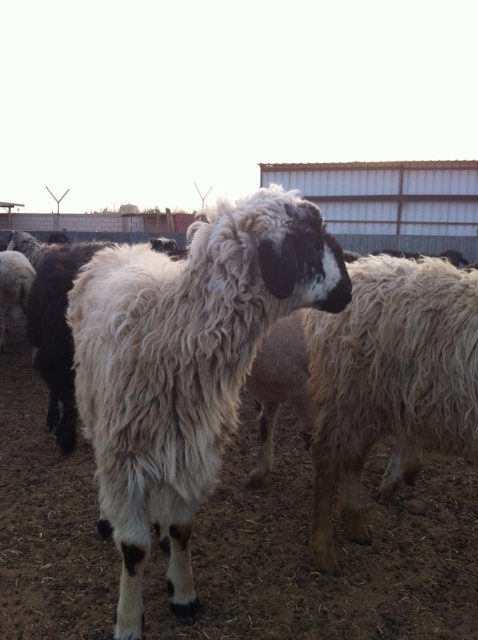
Is white woolen sheep at center closer to the viewer compared to white woolly sheep at center?

Yes.

Which is more to the right, white woolen sheep at center or white woolly sheep at center?

white woolly sheep at center

Does point (181, 451) come behind point (403, 355)?

That is False.

Locate an element on the screen. The image size is (478, 640). white woolen sheep at center is located at coordinates (184, 365).